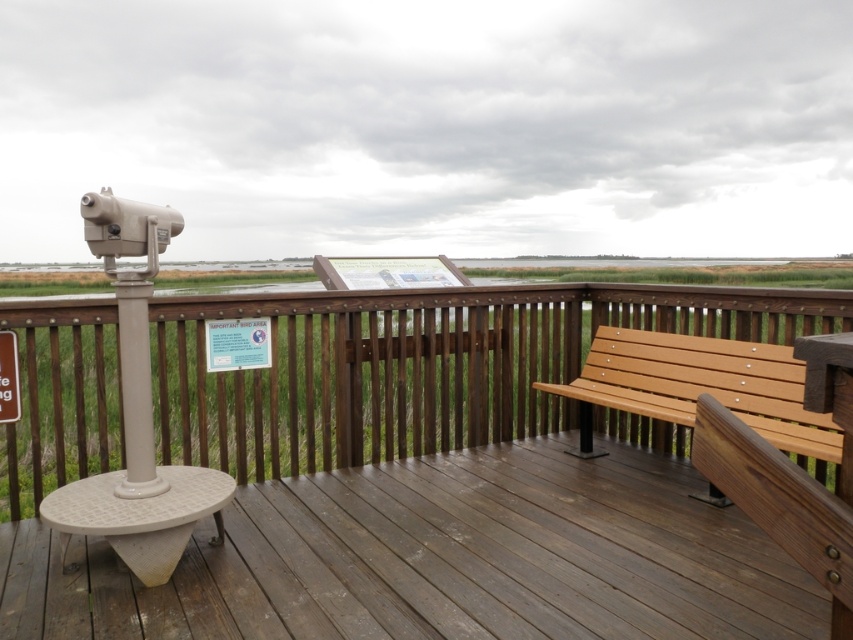
Describe the element at coordinates (421, 365) in the screenshot. I see `wooden bench at center` at that location.

Is wooden bench at center positioned behind wooden bench at right?

Yes.

This screenshot has width=853, height=640. Identify the location of wooden bench at center. (421, 365).